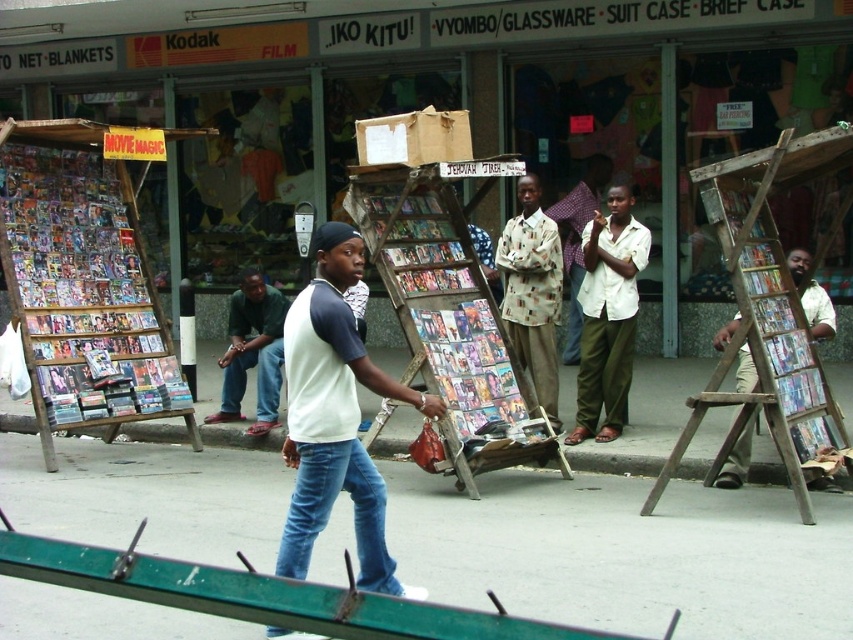
You are standing in front of the street scene described. There are two points marked in the image. The first point is at coordinates point [106,230] and the second is at point [459,264]. Which point is closer to you?

Point [106,230] is closer to you because it is further to the camera than point [459,264].

You are a painter who needs to reach a high window to clean it. You see a wooden ladder at center and jeans at center. Which object should you use to reach the window?

The wooden ladder at center is above jeans at center, so you should use the wooden ladder at center to reach the window.